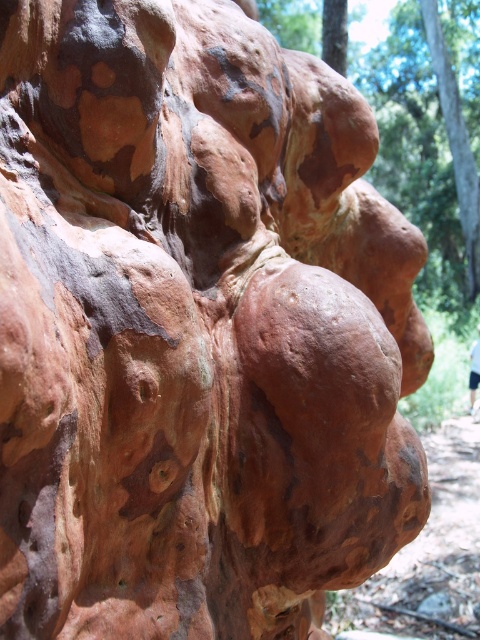
Can you confirm if rustic bark tree trunk at center is positioned above light blue fabric at center?

Indeed, rustic bark tree trunk at center is positioned over light blue fabric at center.

Is the position of rustic bark tree trunk at center less distant than that of light blue fabric at center?

That is False.

The image size is (480, 640). What do you see at coordinates (417, 156) in the screenshot? I see `rustic bark tree trunk at center` at bounding box center [417, 156].

Find the location of `rustic bark tree trunk at center`. rustic bark tree trunk at center is located at coordinates (417, 156).